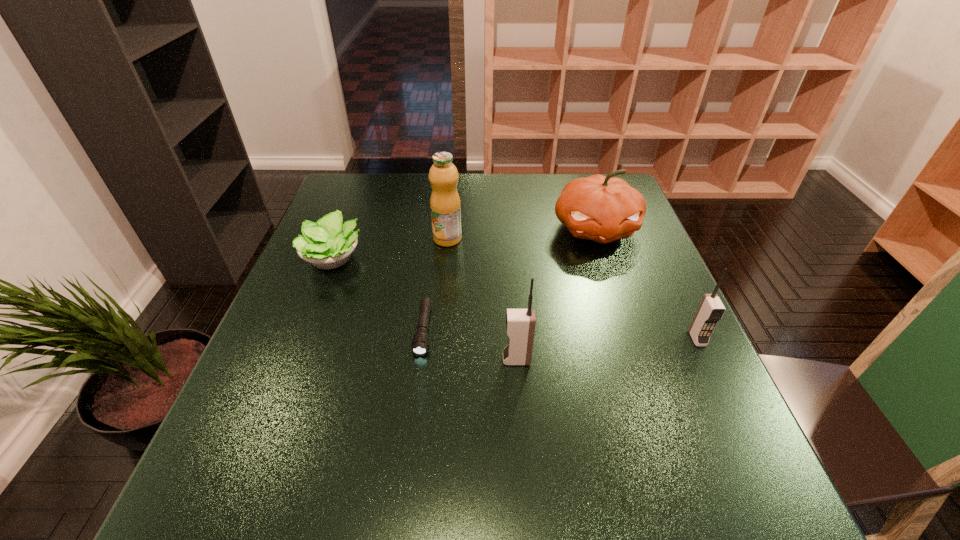
Please show where to add a cellular telephone on the left while keeping spacing even. Please provide its 2D coordinates. Your answer should be formatted as a tuple, i.e. [(x, y)], where the tuple contains the x and y coordinates of a point satisfying the conditions above.

[(319, 383)]